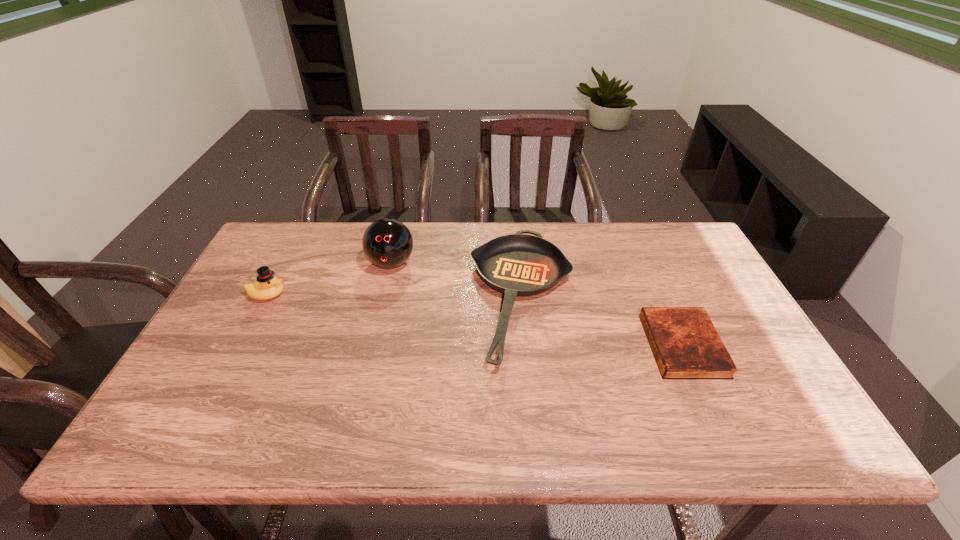
You are a GUI agent. You are given a task and a screenshot of the screen. Output one action in this format:
    pyautogui.click(x=<x>, y=<y>)
    Task: Click on the bowling ball
    The height and width of the screenshot is (540, 960).
    Given the screenshot: What is the action you would take?
    pyautogui.click(x=387, y=243)

I want to click on the third object from right to left, so click(x=387, y=243).

The width and height of the screenshot is (960, 540). What are the coordinates of `the third shortest object` in the screenshot? It's located at (267, 286).

Find the location of `duck`. duck is located at coordinates (267, 286).

You are a GUI agent. You are given a task and a screenshot of the screen. Output one action in this format:
    pyautogui.click(x=<x>, y=<y>)
    Task: Click on the frying pan
    
    Given the screenshot: What is the action you would take?
    pyautogui.click(x=519, y=264)

Locate an element on the screen. The width and height of the screenshot is (960, 540). the third object from left to right is located at coordinates (519, 264).

The image size is (960, 540). What are the coordinates of `Bible` in the screenshot? It's located at (686, 345).

Where is `the rightmost object`? Image resolution: width=960 pixels, height=540 pixels. the rightmost object is located at coordinates (686, 345).

Locate an element on the screen. The width and height of the screenshot is (960, 540). vacant area situated on the surface of the bowling ball near the finger holes is located at coordinates (362, 386).

Image resolution: width=960 pixels, height=540 pixels. I want to click on free region located 0.060m on the front-facing side of the leftmost object, so click(x=308, y=295).